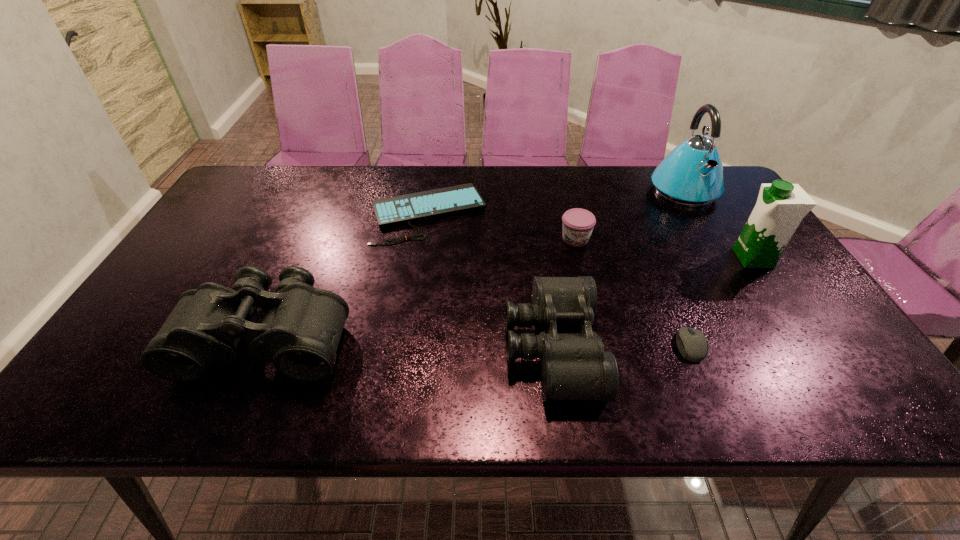
With all binocularss evenly spaced, where should an extra binoculars be placed on the right to continue the pattern? Please point out a vacant space. Please provide its 2D coordinates. Your answer should be formatted as a tuple, i.e. [(x, y)], where the tuple contains the x and y coordinates of a point satisfying the conditions above.

[(847, 357)]